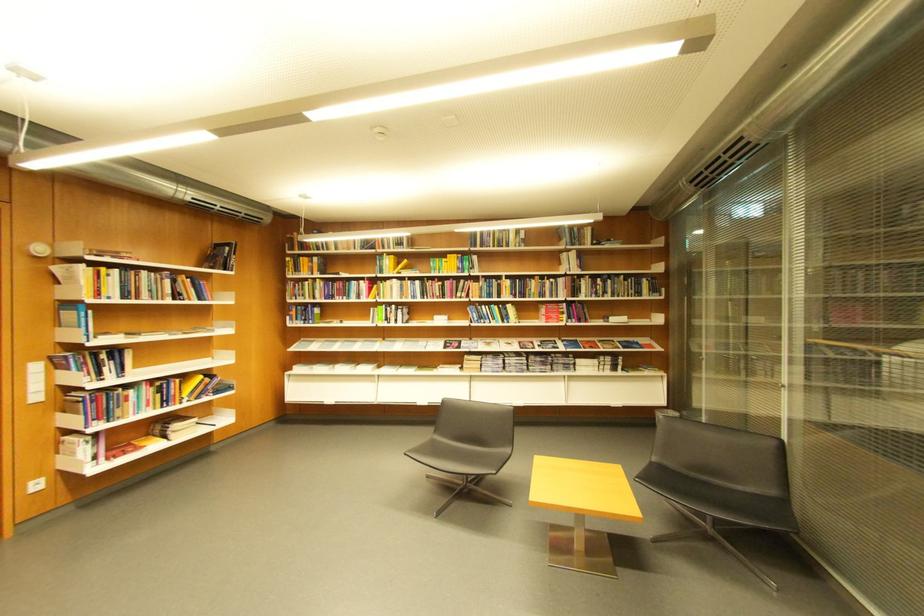
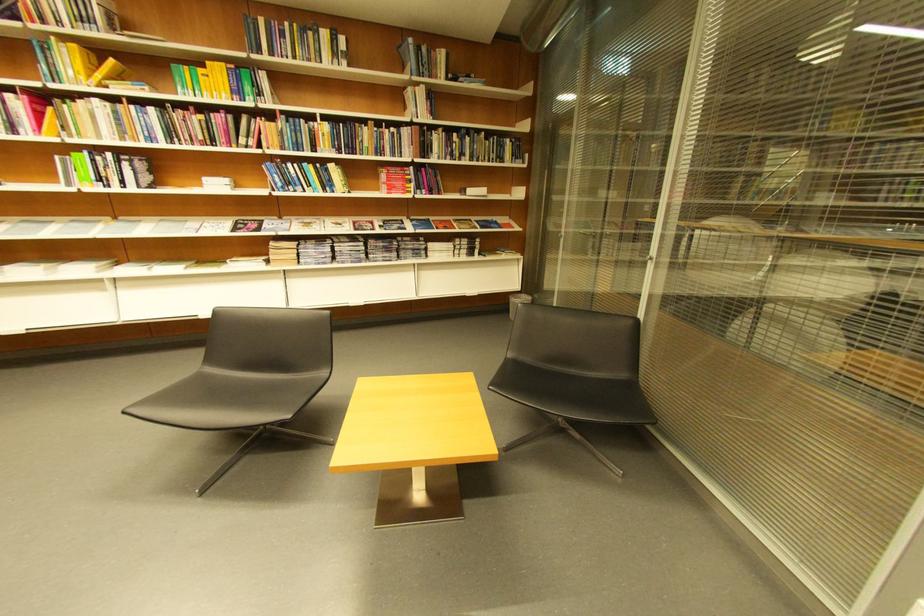
Where in the second image is the point corresponding to point (562, 282) from the first image?

(403, 131)